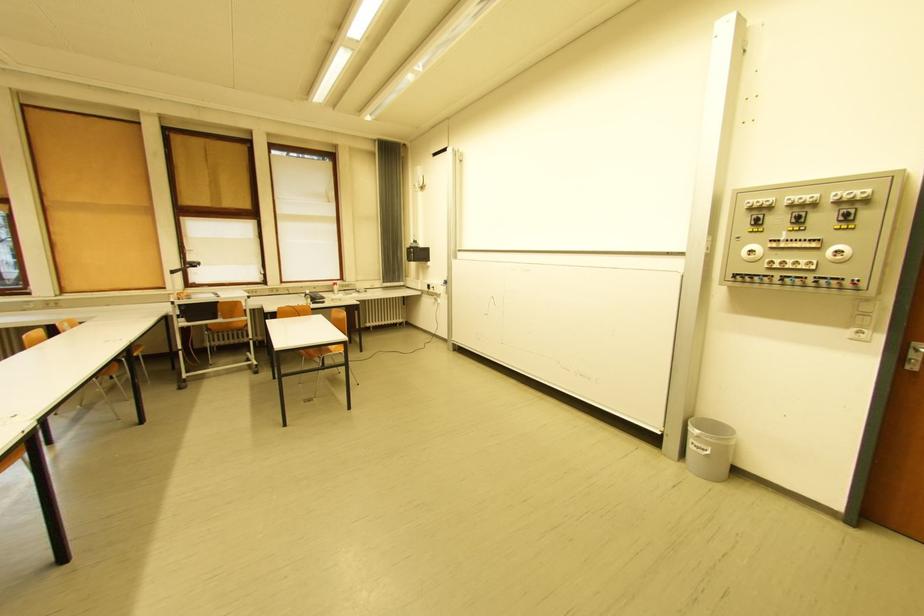
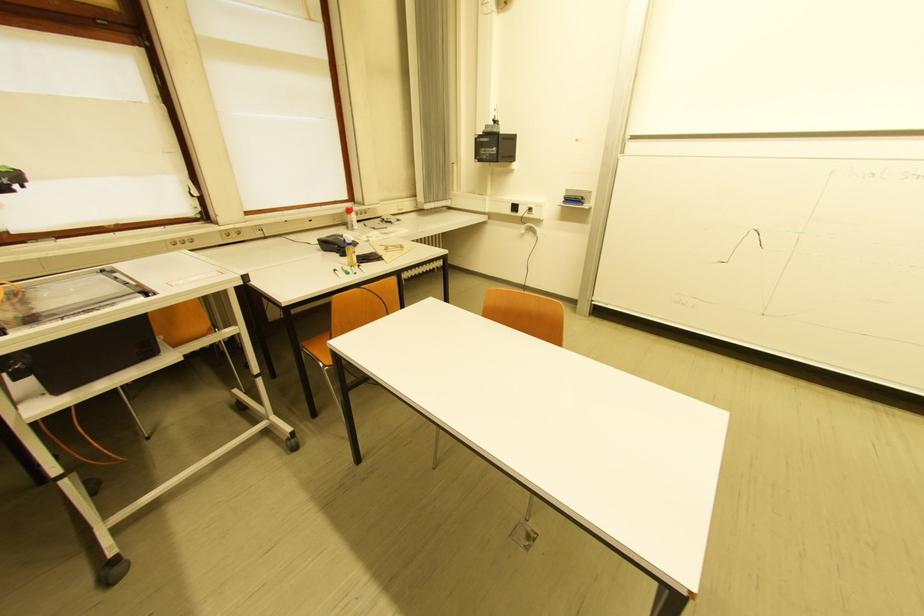
The point at (x=339, y=293) is marked in the first image. Where is the corresponding point in the second image?

(351, 225)